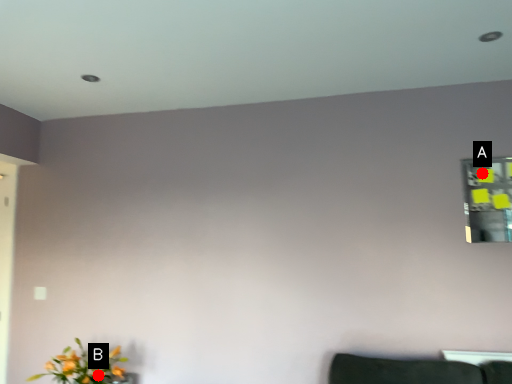
Question: Two points are circled on the image, labeled by A and B beside each circle. Which point is farther to the camera?

Choices:
 (A) A is further
 (B) B is further

Answer: (A)